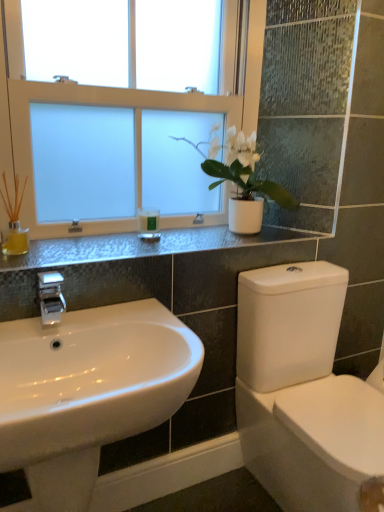
Question: Is green matte candle at center spatially inside white frosted glass window at upper center, or outside of it?

Choices:
 (A) inside
 (B) outside

Answer: (B)

Question: From a real-world perspective, relative to white frosted glass window at upper center, is green matte candle at center vertically above or below?

Choices:
 (A) above
 (B) below

Answer: (B)

Question: Considering the real-world distances, which object is closest to the white glossy bidet at lower right?

Choices:
 (A) silver metallic faucet at left
 (B) metallic gray counter top at upper center
 (C) white glossy sink at lower left
 (D) white matte plant pot at upper center
 (E) green matte candle at center

Answer: (C)

Question: Considering the real-world distances, which object is closest to the white glossy bidet at lower right?

Choices:
 (A) silver metallic faucet at left
 (B) white frosted glass window at upper center
 (C) metallic gray counter top at upper center
 (D) white glossy sink at lower left
 (E) white matte plant pot at upper center

Answer: (D)